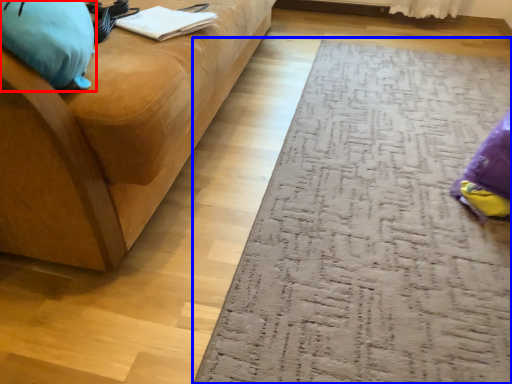
Question: Which point is closer to the camera, bean bag chair (highlighted by a red box) or doormat (highlighted by a blue box)?

Choices:
 (A) bean bag chair
 (B) doormat

Answer: (A)